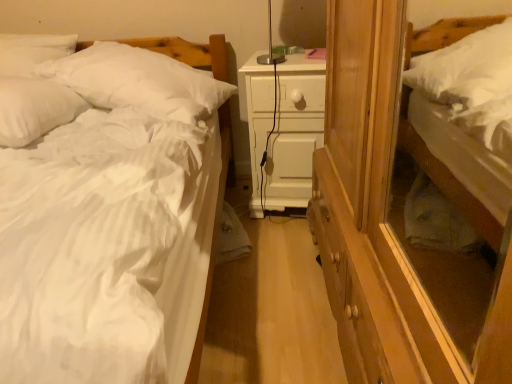
Question: Visually, is white soft pillow at left, which ranks as the 1th pillow in left-to-right order, positioned to the left or to the right of white soft bed at right, which is counted as the 1th bed, starting from the right?

Choices:
 (A) right
 (B) left

Answer: (B)

Question: From the image's perspective, is white soft pillow at left, the second pillow viewed from the right, above or below white soft bed at right, which is counted as the 1th bed, starting from the right?

Choices:
 (A) below
 (B) above

Answer: (A)

Question: Which is nearer to the white soft bed at right, which is counted as the 1th bed, starting from the right?

Choices:
 (A) white matte nightstand at center
 (B) white soft bed at left, marked as the 1th bed in a left-to-right arrangement
 (C) white soft pillow at left, which ranks as the 1th pillow in left-to-right order
 (D) white soft pillow at upper left, which is the second pillow in left-to-right order

Answer: (A)

Question: Estimate the real-world distances between objects in this image. Which object is closer to the white matte nightstand at center?

Choices:
 (A) white soft pillow at upper left, which is the second pillow in left-to-right order
 (B) white soft pillow at left, which ranks as the 1th pillow in left-to-right order
 (C) white soft bed at right, marked as the 2th bed in a left-to-right arrangement
 (D) white soft bed at left, which is the second bed in right-to-left order

Answer: (D)